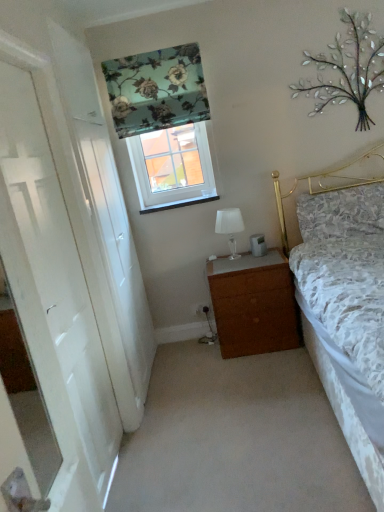
You are a GUI agent. You are given a task and a screenshot of the screen. Output one action in this format:
    pyautogui.click(x=<x>, y=<y>)
    Task: Click on the free area in between white glossy door at left and brown wood chest of drawers at center
    The width and height of the screenshot is (384, 512).
    Given the screenshot: What is the action you would take?
    pyautogui.click(x=195, y=362)